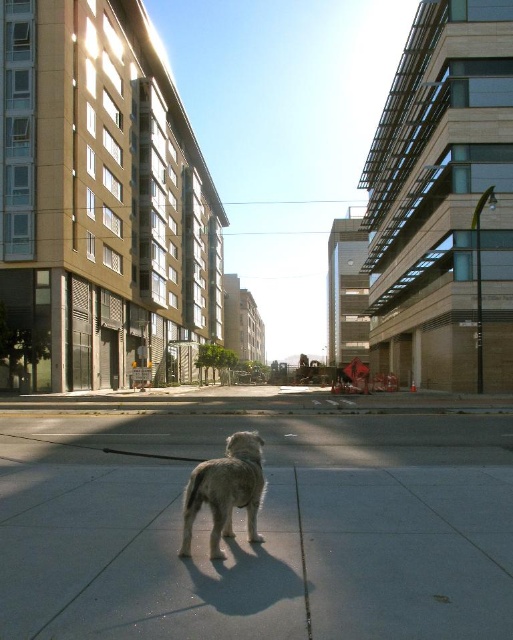
You are a pedestrian standing at the edge of the gray concrete pavement at center and want to reach the light brown fur dog at center. Which direction should you move to approach the dog?

You should move to the left because the gray concrete pavement at center is to the right of the light brown fur dog at center, so moving left from the pavement will bring you closer to the dog.

You are standing at the point marked by the coordinates (x=261, y=531) in the image. Looking around, you see the gray concrete pavement at center. What is the material of the surface you are standing on?

The point marked by the coordinates (x=261, y=531) corresponds to the gray concrete pavement at center, so the material of the surface is concrete.

You are standing at the point labeled point (415, 604) and want to walk towards the point labeled point (220, 497). Since you can only move forward, will you pass by the small dog standing on the paved area before reaching your destination?

Yes, you will pass by the small dog standing on the paved area before reaching point (220, 497) because point (415, 604) is in front of point (220, 497), meaning the dog is located between them.